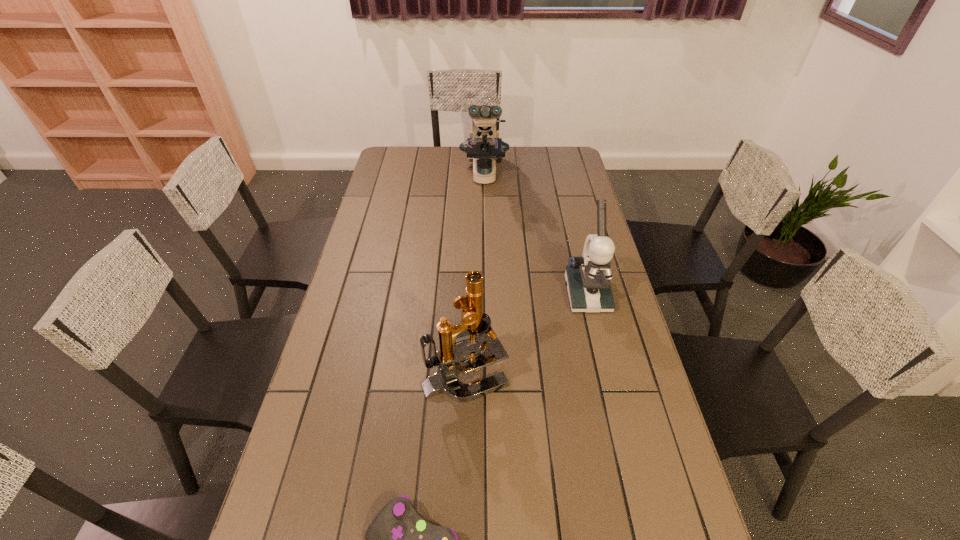
What are the coordinates of `vacant region that satisfies the following two spatial constraints: 1. through the eyepieces of the farthest microscope; 2. at the eyepiece of the third farthest object` in the screenshot? It's located at (487, 372).

The height and width of the screenshot is (540, 960). I want to click on free space in the image that satisfies the following two spatial constraints: 1. through the eyepieces of the rightmost microscope; 2. on the right side of the farthest microscope, so click(x=486, y=294).

I want to click on vacant region that satisfies the following two spatial constraints: 1. through the eyepieces of the farthest microscope; 2. at the eyepiece of the second nearest object, so click(x=487, y=372).